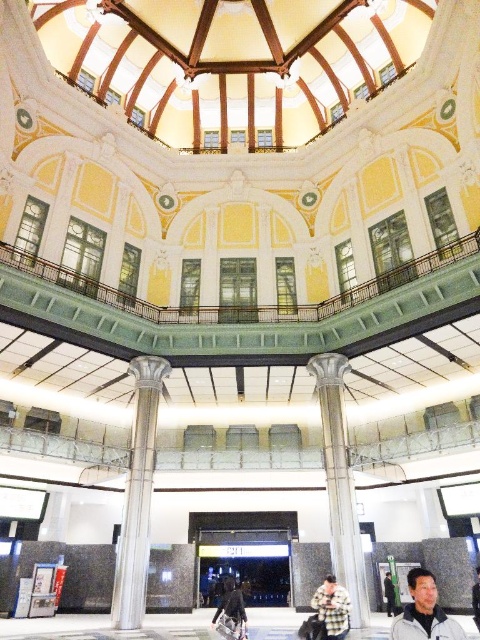
You are standing in the grand hall and want to place a small potted plant between the polished silver column at center and the dark gray fabric jacket at lower center. According to the scene description, where should you position the plant?

The polished silver column at center is to the right of the dark gray fabric jacket at lower center, so you should place the plant between them by positioning it to the right of the dark gray fabric jacket at lower center and to the left of the polished silver column at center.

You are a visitor standing in the grand hall of the train station. You see the polished silver column at center and the dark gray fabric jacket at lower center. Which object is taller?

The polished silver column at center is much taller than the dark gray fabric jacket at lower center.

From the picture: You are standing in the grand hall and see the polished silver column at center and the fluffy beige coat at center. From your perspective, which object is positioned to the right?

The polished silver column at center is to the right of the fluffy beige coat at center.